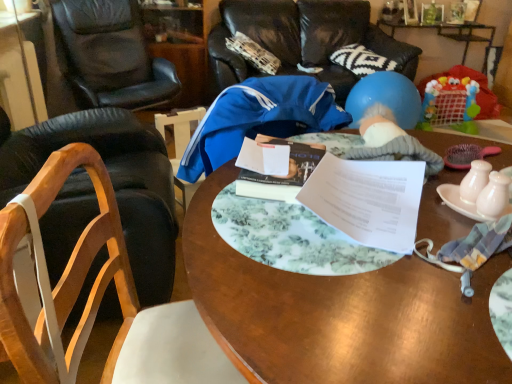
Question: Is blue rubber ball at upper right smaller than black leather chair at left, which is the third chair from front to back?

Choices:
 (A) yes
 (B) no

Answer: (A)

Question: Is blue rubber ball at upper right outside of black leather chair at left, acting as the second chair starting from the back?

Choices:
 (A) yes
 (B) no

Answer: (A)

Question: Does blue rubber ball at upper right have a lesser height compared to black leather chair at left, which is the third chair from front to back?

Choices:
 (A) yes
 (B) no

Answer: (A)

Question: Is blue rubber ball at upper right positioned far away from black leather chair at left, which is the third chair from front to back?

Choices:
 (A) yes
 (B) no

Answer: (A)

Question: Is blue rubber ball at upper right wider than black leather chair at left, which is the third chair from front to back?

Choices:
 (A) yes
 (B) no

Answer: (B)

Question: Is blue rubber ball at upper right thinner than black leather chair at left, which is the third chair from front to back?

Choices:
 (A) no
 (B) yes

Answer: (B)

Question: Considering the relative sizes of pink ceramic plate at right and wooden chair at left, positioned as the 3th chair in back-to-front order, in the image provided, is pink ceramic plate at right thinner than wooden chair at left, positioned as the 3th chair in back-to-front order,?

Choices:
 (A) no
 (B) yes

Answer: (B)

Question: Considering the relative sizes of pink ceramic plate at right and wooden chair at left, positioned as the 3th chair in back-to-front order, in the image provided, is pink ceramic plate at right smaller than wooden chair at left, positioned as the 3th chair in back-to-front order,?

Choices:
 (A) no
 (B) yes

Answer: (B)

Question: Does pink ceramic plate at right have a larger size compared to wooden chair at left, positioned as the 3th chair in back-to-front order?

Choices:
 (A) yes
 (B) no

Answer: (B)

Question: Is pink ceramic plate at right placed right next to wooden chair at left, the second chair in the front-to-back sequence?

Choices:
 (A) yes
 (B) no

Answer: (B)

Question: Is pink ceramic plate at right at the left side of wooden chair at left, the second chair in the front-to-back sequence?

Choices:
 (A) no
 (B) yes

Answer: (A)

Question: Could you tell me if pink ceramic plate at right is facing wooden chair at left, positioned as the 3th chair in back-to-front order?

Choices:
 (A) yes
 (B) no

Answer: (B)

Question: From a real-world perspective, does wooden chair at left, positioned as the 3th chair in back-to-front order, stand above blue fabric chair at upper center, the 4th chair from the front?

Choices:
 (A) no
 (B) yes

Answer: (B)